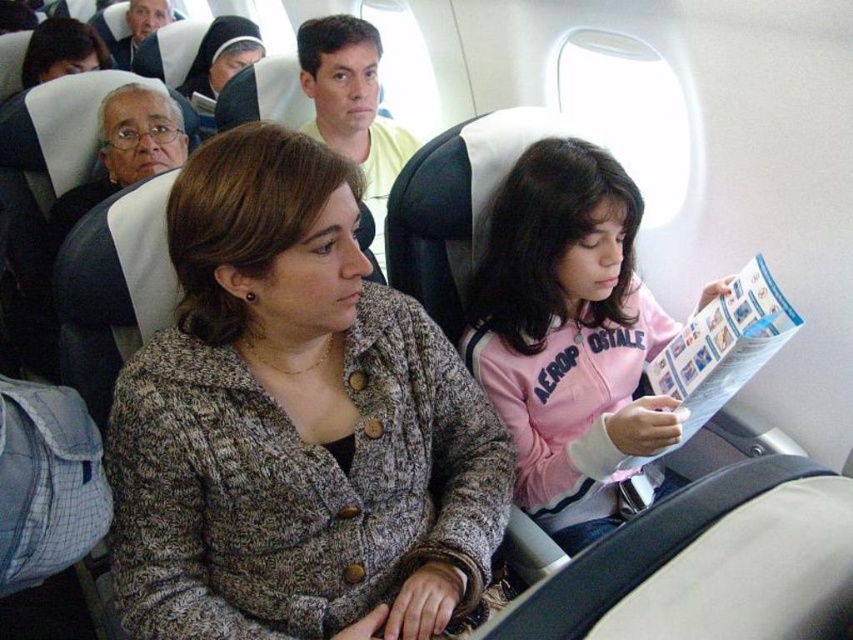
Can you confirm if knitted gray sweater at center is thinner than blue glossy magazine at center right?

No, knitted gray sweater at center is not thinner than blue glossy magazine at center right.

Can you confirm if knitted gray sweater at center is wider than blue glossy magazine at center right?

Indeed, knitted gray sweater at center has a greater width compared to blue glossy magazine at center right.

Who is more forward, (230,512) or (688,342)?

Point (230,512) is in front.

Image resolution: width=853 pixels, height=640 pixels. I want to click on knitted gray sweater at center, so click(x=294, y=422).

Is pink fleece jacket at center positioned before yellow cotton shirt at center?

Yes, pink fleece jacket at center is closer to the viewer.

Between point (608, 476) and point (381, 132), which one is positioned in front?

Point (608, 476)

Who is more distant from viewer, (639, 321) or (375, 65)?

The point (375, 65) is more distant.

Find the location of a particular element. pink fleece jacket at center is located at coordinates (567, 336).

Can you confirm if blue glossy magazine at center right is positioned to the right of yellow cotton shirt at center?

Indeed, blue glossy magazine at center right is positioned on the right side of yellow cotton shirt at center.

Does blue glossy magazine at center right appear over yellow cotton shirt at center?

No.

Which is behind, point (721, 344) or point (392, 129)?

Point (392, 129)

Where is `blue glossy magazine at center right`? blue glossy magazine at center right is located at coordinates (720, 349).